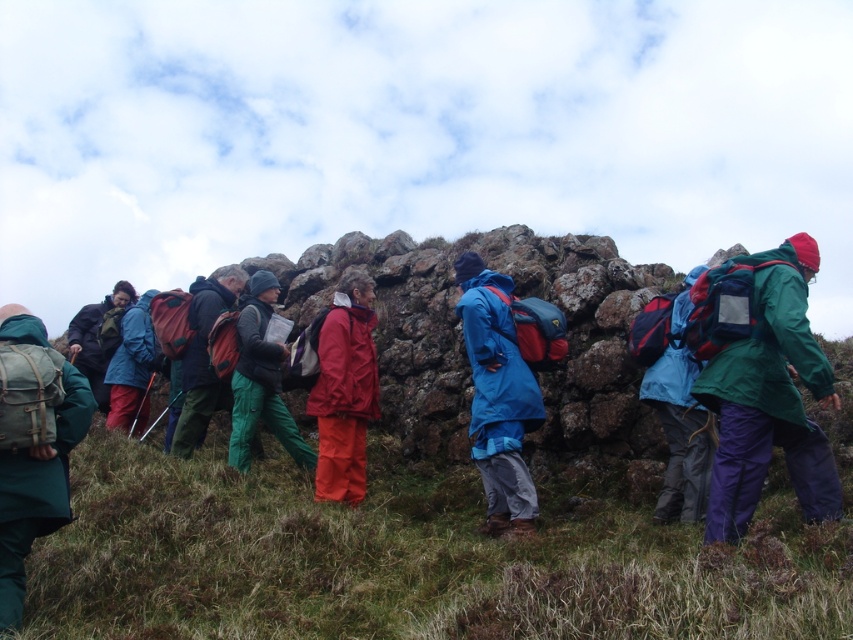
Looking at this image, does green matte jacket at center appear under green fabric jacket at center?

No.

Can you confirm if green matte jacket at center is thinner than green fabric jacket at center?

In fact, green matte jacket at center might be wider than green fabric jacket at center.

The height and width of the screenshot is (640, 853). What do you see at coordinates (762, 385) in the screenshot?
I see `green matte jacket at center` at bounding box center [762, 385].

Where is `green matte jacket at center`? This screenshot has height=640, width=853. green matte jacket at center is located at coordinates (762, 385).

Does matte red pants at center have a smaller size compared to matte blue jacket at center?

Indeed, matte red pants at center has a smaller size compared to matte blue jacket at center.

Who is lower down, matte red pants at center or matte blue jacket at center?

matte red pants at center

What are the coordinates of `matte red pants at center` in the screenshot? It's located at (345, 388).

Does blue matte jacket at center come behind green fabric jacket at center?

No.

Can you confirm if blue matte jacket at center is taller than green fabric jacket at center?

Yes, blue matte jacket at center is taller than green fabric jacket at center.

This screenshot has height=640, width=853. What are the coordinates of `blue matte jacket at center` in the screenshot? It's located at (497, 396).

Image resolution: width=853 pixels, height=640 pixels. Find the location of `blue matte jacket at center`. blue matte jacket at center is located at coordinates (497, 396).